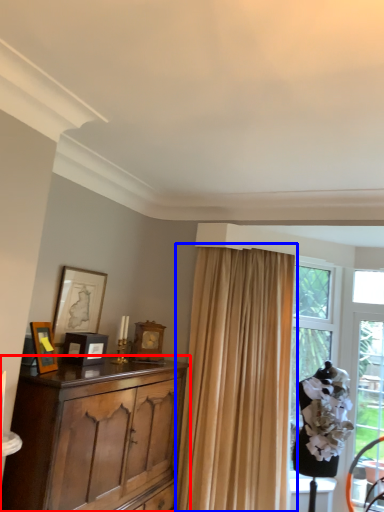
Question: Which object is closer to the camera taking this photo, cabinetry (highlighted by a red box) or curtain (highlighted by a blue box)?

Choices:
 (A) cabinetry
 (B) curtain

Answer: (A)